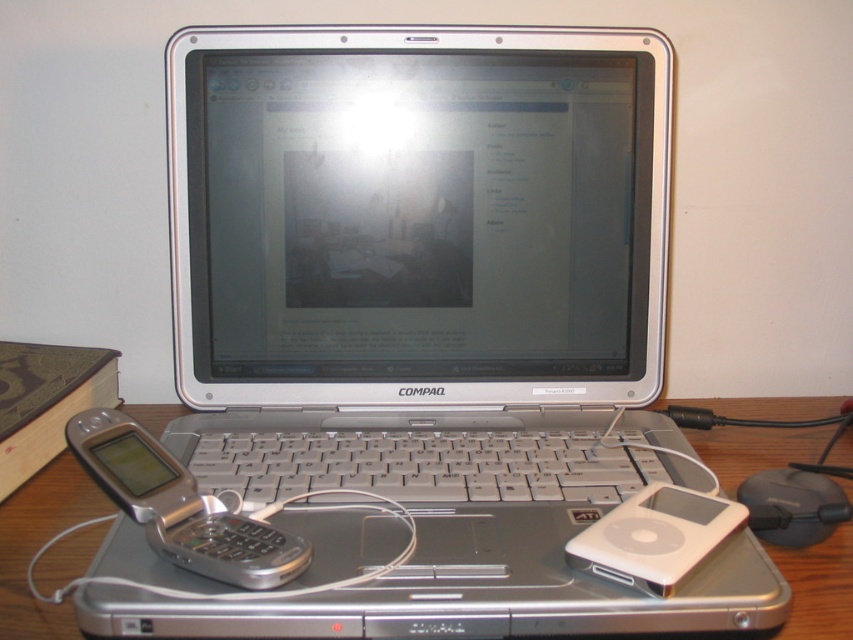
Question: Is silver metallic phone at lower left positioned before white plastic ipod at lower right?

Choices:
 (A) no
 (B) yes

Answer: (B)

Question: Which object is the closest to the black plastic mouse at lower right?

Choices:
 (A) white plastic ipod at lower right
 (B) wooden table at lower center

Answer: (B)

Question: Which point appears farthest from the camera in this image?

Choices:
 (A) [711, 548]
 (B) [791, 500]

Answer: (B)

Question: Can you confirm if silver metallic phone at lower left is wider than white plastic ipod at lower right?

Choices:
 (A) no
 (B) yes

Answer: (B)

Question: From the image, what is the correct spatial relationship of silver metallic phone at lower left in relation to black plastic mouse at lower right?

Choices:
 (A) below
 (B) above

Answer: (B)

Question: Among these objects, which one is farthest from the camera?

Choices:
 (A) black plastic mouse at lower right
 (B) white plastic ipod at lower right

Answer: (A)